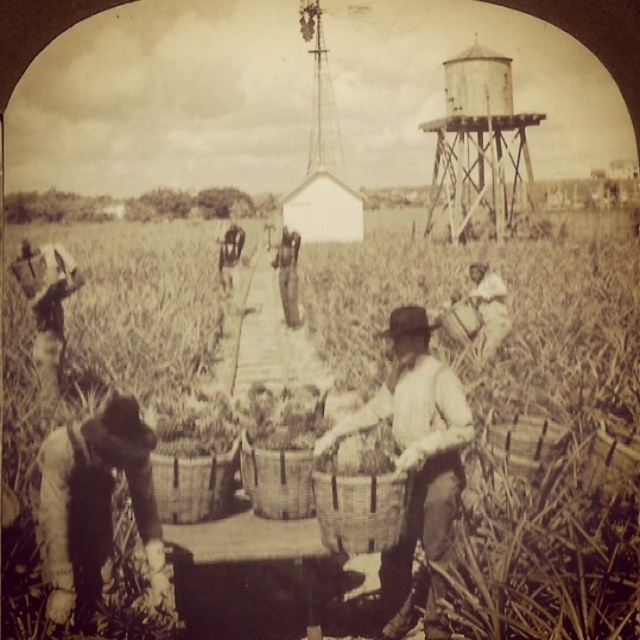
Who is positioned more to the left, woven basket at center or dark brown fabric at lower left?

dark brown fabric at lower left is more to the left.

Between point (428, 484) and point (60, 568), which one is positioned in front?

Positioned in front is point (60, 568).

Find the location of `woven basket at center`. woven basket at center is located at coordinates (416, 454).

Is woven basket at center to the right of wooden water tower at upper right from the viewer's perspective?

Incorrect, woven basket at center is not on the right side of wooden water tower at upper right.

Can you confirm if woven basket at center is thinner than wooden water tower at upper right?

No, woven basket at center is not thinner than wooden water tower at upper right.

What do you see at coordinates (416, 454) in the screenshot?
I see `woven basket at center` at bounding box center [416, 454].

Identify the location of woven basket at center. (416, 454).

Is point (68, 564) positioned behind point (504, 189)?

No, it is not.

Does dark brown fabric at lower left appear on the left side of wooden water tower at upper right?

Correct, you'll find dark brown fabric at lower left to the left of wooden water tower at upper right.

Which is behind, point (102, 516) or point (513, 120)?

The point (513, 120) is more distant.

Locate an element on the screen. This screenshot has height=640, width=640. dark brown fabric at lower left is located at coordinates (93, 504).